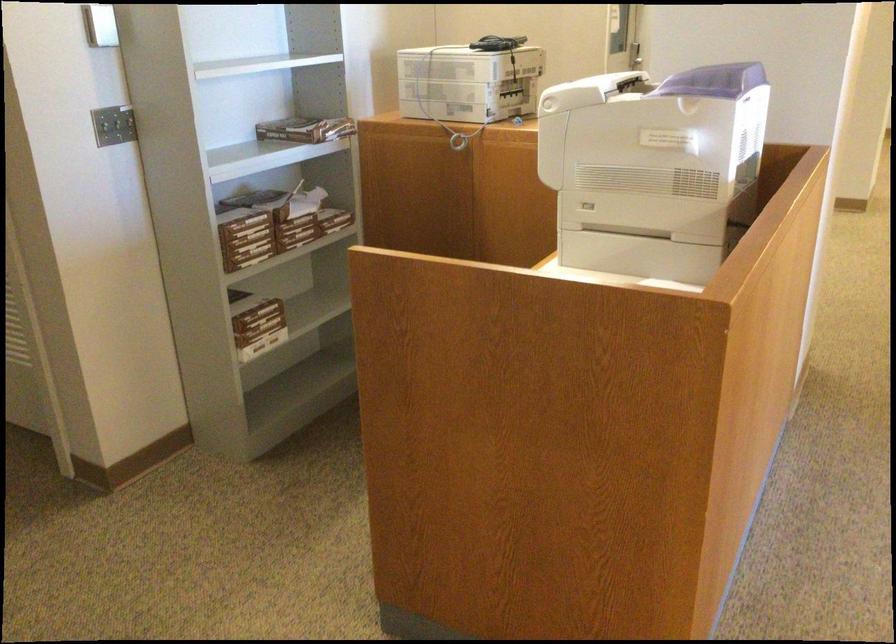
The height and width of the screenshot is (644, 896). Describe the element at coordinates (640, 254) in the screenshot. I see `a printer paper tray` at that location.